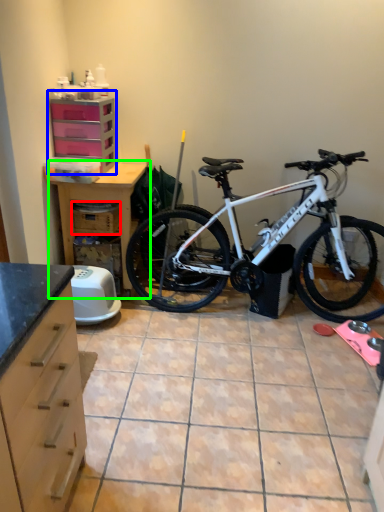
Question: Estimate the real-world distances between objects in this image. Which object is closer to crate (highlighted by a red box), file cabinet (highlighted by a blue box) or table (highlighted by a green box)?

Choices:
 (A) file cabinet
 (B) table

Answer: (B)